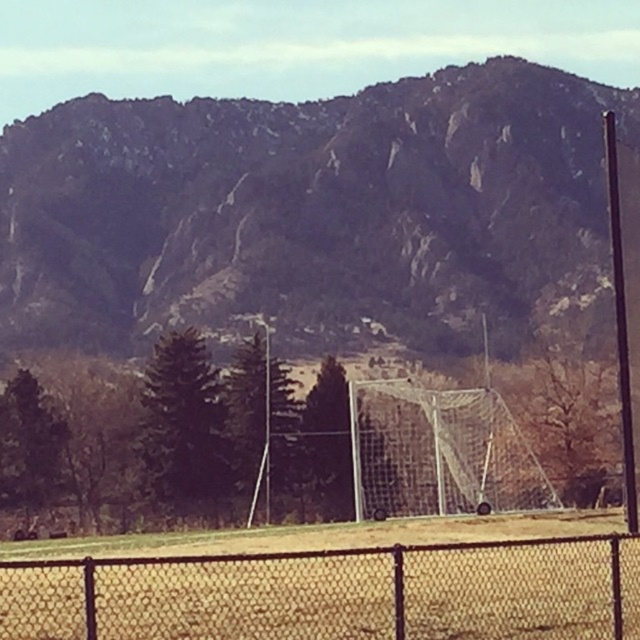
Question: Which of the following is the closest to the observer?

Choices:
 (A) black chain-link fence at lower center
 (B) rugged rock mountain at upper center

Answer: (A)

Question: Which point appears farthest from the camera in this image?

Choices:
 (A) (209, 612)
 (B) (531, 262)

Answer: (B)

Question: Is rugged rock mountain at upper center to the left of black chain-link fence at lower center from the viewer's perspective?

Choices:
 (A) yes
 (B) no

Answer: (B)

Question: Can you confirm if rugged rock mountain at upper center is positioned above black chain-link fence at lower center?

Choices:
 (A) yes
 (B) no

Answer: (A)

Question: Which of the following is the farthest from the observer?

Choices:
 (A) (307, 612)
 (B) (170, 284)

Answer: (B)

Question: Can you confirm if rugged rock mountain at upper center is positioned above black chain-link fence at lower center?

Choices:
 (A) yes
 (B) no

Answer: (A)